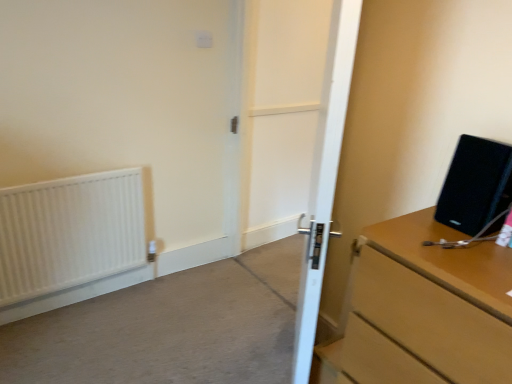
Question: In terms of height, does white matte radiator at left look taller or shorter compared to white wooden door at center?

Choices:
 (A) short
 (B) tall

Answer: (A)

Question: From the image's perspective, is white matte radiator at left positioned above or below white wooden door at center?

Choices:
 (A) below
 (B) above

Answer: (A)

Question: Which of these objects is positioned closest to the black matte speaker at right?

Choices:
 (A) white wooden door at center
 (B) wooden chest of drawers at right
 (C) white wooden door at center
 (D) white matte radiator at left

Answer: (B)

Question: Estimate the real-world distances between objects in this image. Which object is farther from the wooden chest of drawers at right?

Choices:
 (A) black matte speaker at right
 (B) white matte radiator at left
 (C) white wooden door at center
 (D) white wooden door at center

Answer: (D)